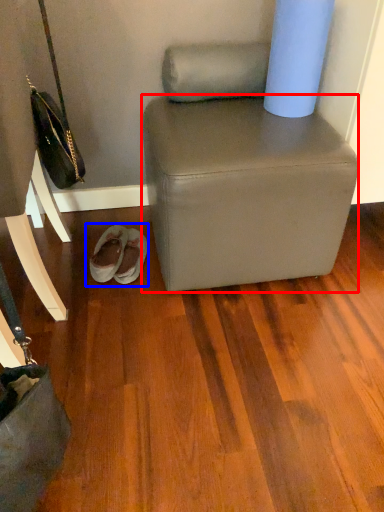
Question: Among these objects, which one is nearest to the camera, stool (highlighted by a red box) or footwear (highlighted by a blue box)?

Choices:
 (A) stool
 (B) footwear

Answer: (A)